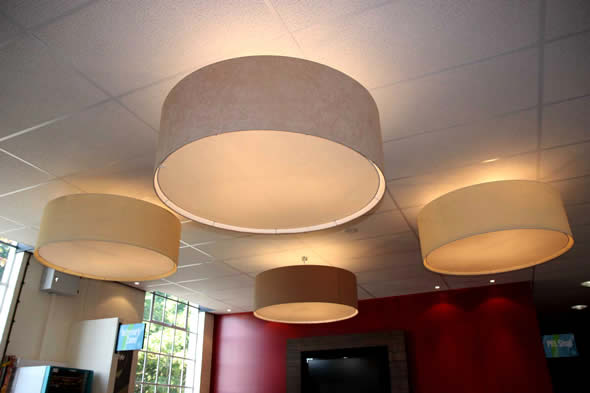
Locate an element on the screen. wall is located at coordinates [32, 326].